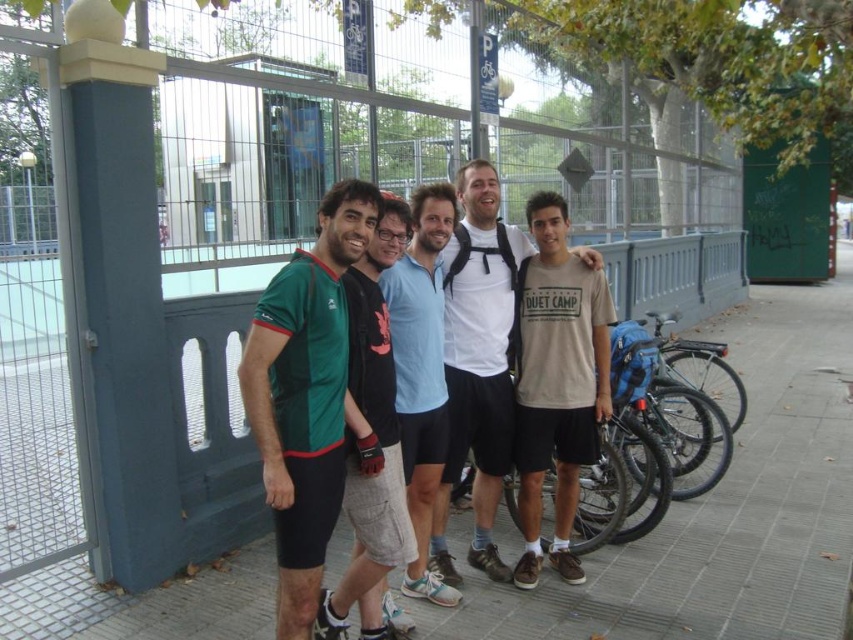
You are a photographer trying to capture a group photo. You notice the green matte jersey at center and the light blue cotton shirt at center. Which clothing item is wider?

The green matte jersey at center is wider than the light blue cotton shirt at center.